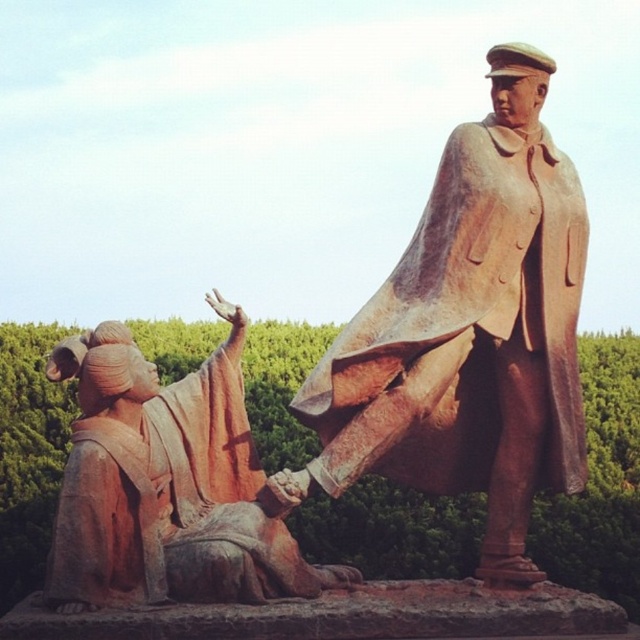
Which of these two, rustic bronze statue at upper right or rustic stone statue at lower left, stands taller?

rustic bronze statue at upper right is taller.

Between rustic bronze statue at upper right and rustic stone statue at lower left, which one appears on the left side from the viewer's perspective?

rustic stone statue at lower left

At what (x,y) coordinates should I click in order to perform the action: click on rustic bronze statue at upper right. Please return your answer as a coordinate pair (x, y). Looking at the image, I should click on (470, 332).

Find the location of `rustic bronze statue at upper right`. rustic bronze statue at upper right is located at coordinates (470, 332).